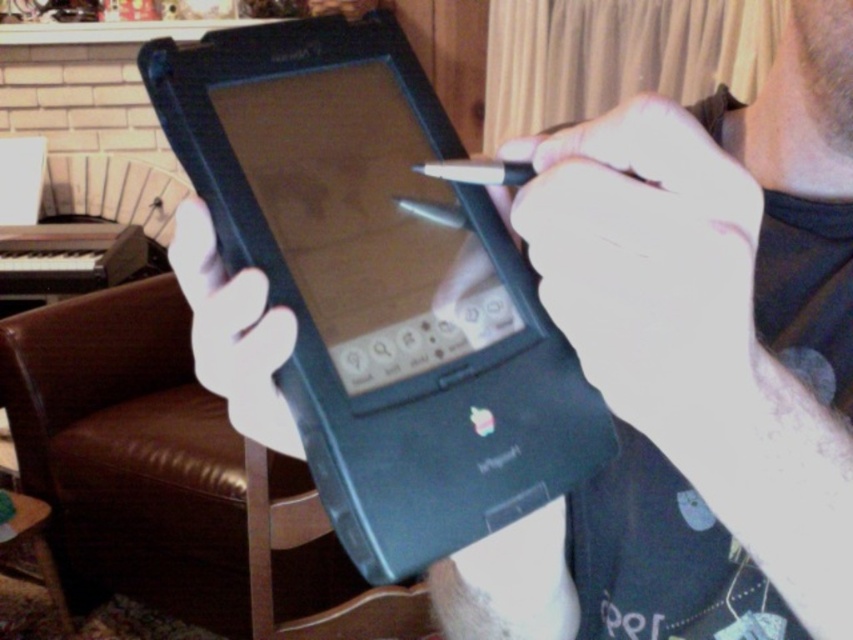
Question: Is white matte pen at upper center wider than white matte hand at center?

Choices:
 (A) yes
 (B) no

Answer: (A)

Question: Which point is closer to the camera?

Choices:
 (A) black plastic tablet at center
 (B) white matte pen at upper center
 (C) white matte hand at center

Answer: (B)

Question: Which point is closer to the camera?

Choices:
 (A) (631, 364)
 (B) (364, 116)
 (C) (277, 307)

Answer: (A)

Question: Which object is closer to the camera taking this photo?

Choices:
 (A) black plastic tablet at center
 (B) white matte pen at upper center
 (C) white matte hand at center

Answer: (B)

Question: Is the position of black plastic tablet at center less distant than that of white matte hand at center?

Choices:
 (A) yes
 (B) no

Answer: (A)

Question: Is black plastic tablet at center thinner than white matte pen at upper center?

Choices:
 (A) no
 (B) yes

Answer: (A)